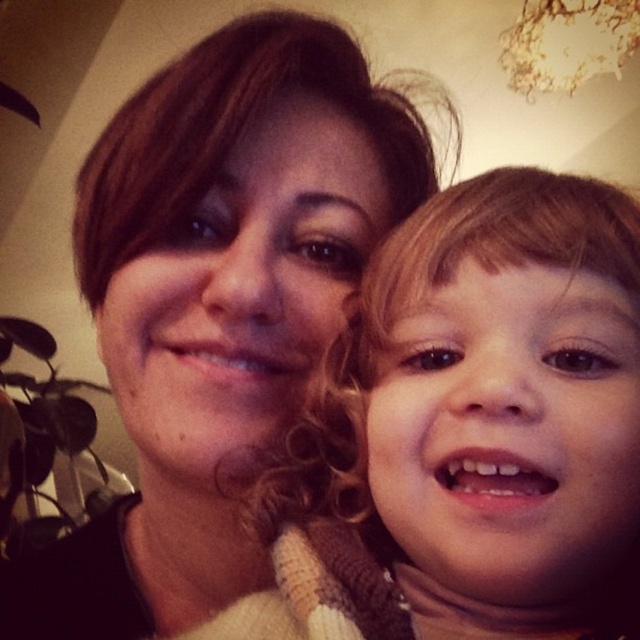
You are a photographer adjusting the camera focus. The smooth beige sweater at center and the matte brown hair at center are both in the frame. The minimum focus distance of your camera is 5 inches. Can you focus on both objects without refocusing?

The distance between the smooth beige sweater at center and the matte brown hair at center is 5.03 inches. Since the camera requires a minimum of 5 inches between objects to focus on both, you can focus on both objects without needing to refocus.

You are a photographer trying to adjust the lighting for a portrait. You notice the smooth beige sweater at center and the matte brown hair at center in your frame. Which object should you focus the light on to ensure the right side of the frame is properly illuminated?

The smooth beige sweater at center is to the right of matte brown hair at center, so focusing the light on the smooth beige sweater at center will ensure the right side of the frame is properly illuminated.

You are a photographer adjusting the lighting for a portrait. You notice the smooth beige sweater at center and the matte brown hair at center. Which object should you focus on first to ensure proper exposure, considering their position?

The smooth beige sweater at center is in front of the matte brown hair at center, so you should focus on the smooth beige sweater at center first to ensure proper exposure.